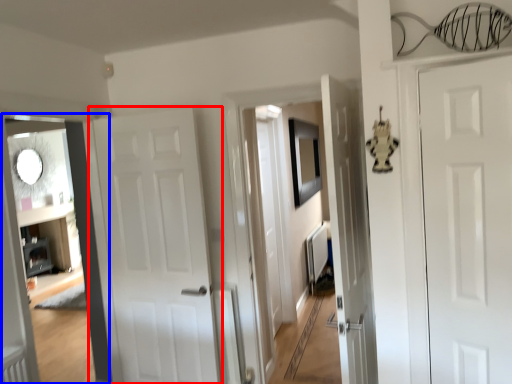
Question: Which object is closer to the camera taking this photo, door (highlighted by a red box) or corridor (highlighted by a blue box)?

Choices:
 (A) door
 (B) corridor

Answer: (B)